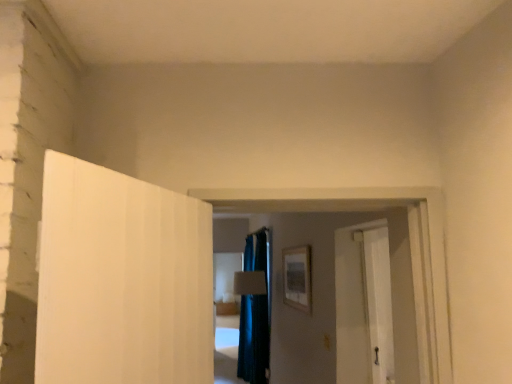
This screenshot has width=512, height=384. What are the coordinates of `dark blue fabric curtain at center` in the screenshot? It's located at (255, 313).

Describe the element at coordinates (255, 313) in the screenshot. The image size is (512, 384). I see `dark blue fabric curtain at center` at that location.

Where is `dark blue fabric curtain at center`? This screenshot has width=512, height=384. dark blue fabric curtain at center is located at coordinates (255, 313).